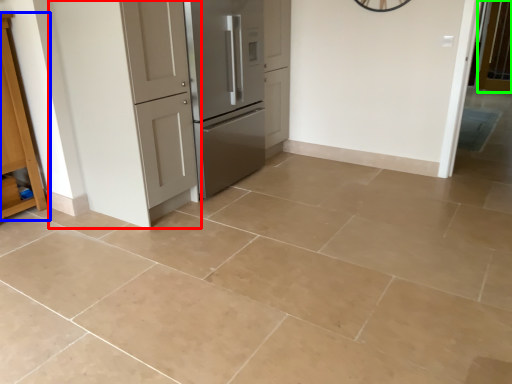
Question: Considering the real-world distances, which object is farthest from door (highlighted by a red box)? cabinetry (highlighted by a blue box) or screen door (highlighted by a green box)?

Choices:
 (A) cabinetry
 (B) screen door

Answer: (B)